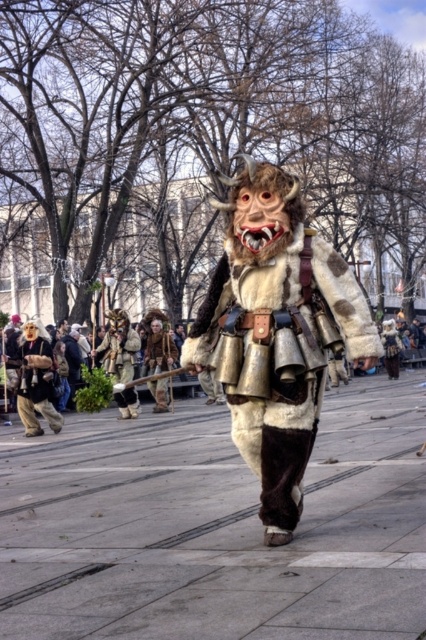
Question: Is concrete paving at center above furry costume at center?

Choices:
 (A) yes
 (B) no

Answer: (B)

Question: Where is concrete paving at center located in relation to furry costume at center in the image?

Choices:
 (A) below
 (B) above

Answer: (A)

Question: Among these objects, which one is farthest from the camera?

Choices:
 (A) furry costume at center
 (B) concrete paving at center

Answer: (A)

Question: Can you confirm if concrete paving at center is positioned below furry costume at center?

Choices:
 (A) no
 (B) yes

Answer: (B)

Question: Which of the following is the closest to the observer?

Choices:
 (A) (65, 541)
 (B) (226, 205)

Answer: (B)